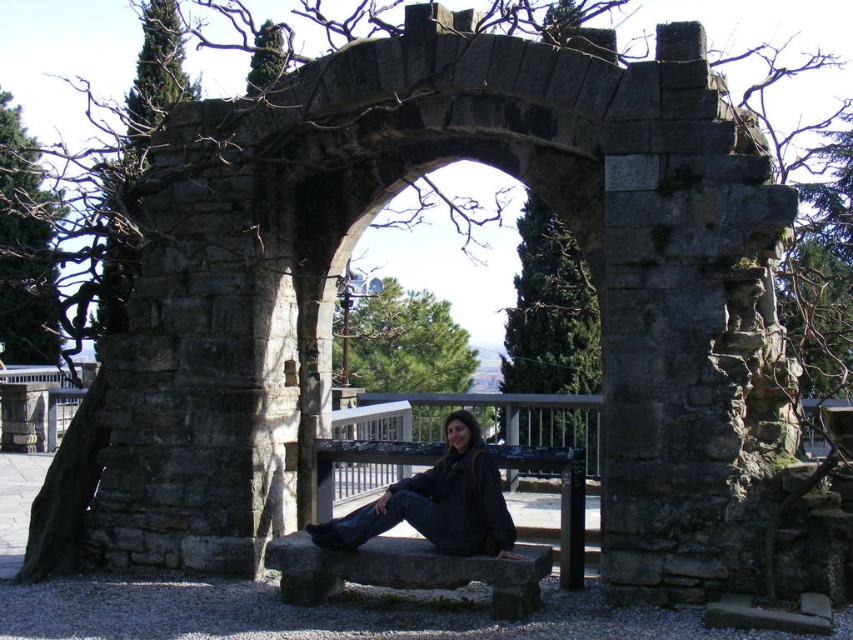
Who is positioned more to the left, gray stone bench at center or dark gray stone bench at center?

Positioned to the left is gray stone bench at center.

Between point (440, 577) and point (326, 464), which one is positioned behind?

The point (326, 464) is more distant.

You are a GUI agent. You are given a task and a screenshot of the screen. Output one action in this format:
    pyautogui.click(x=<x>, y=<y>)
    Task: Click on the gray stone bench at center
    The height and width of the screenshot is (640, 853).
    Given the screenshot: What is the action you would take?
    pyautogui.click(x=405, y=570)